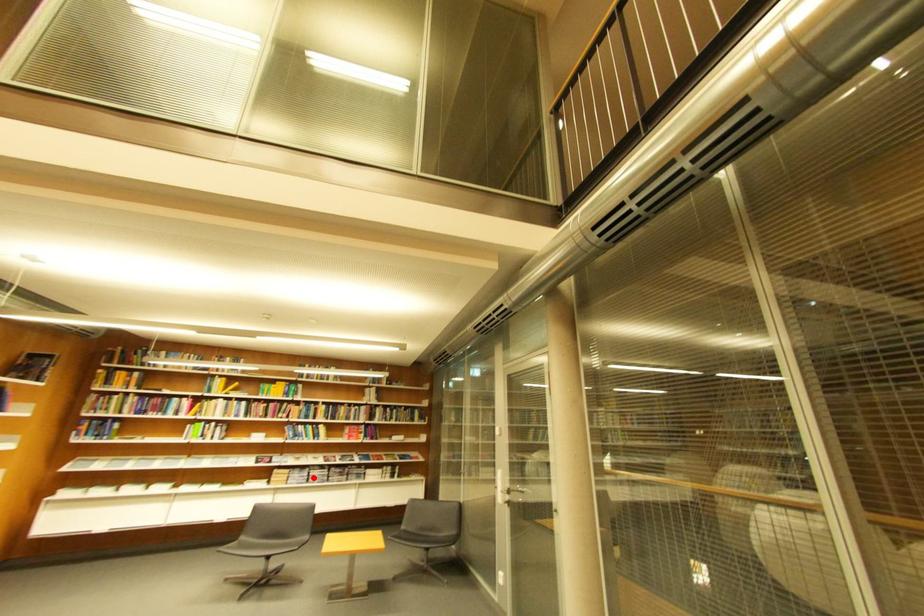
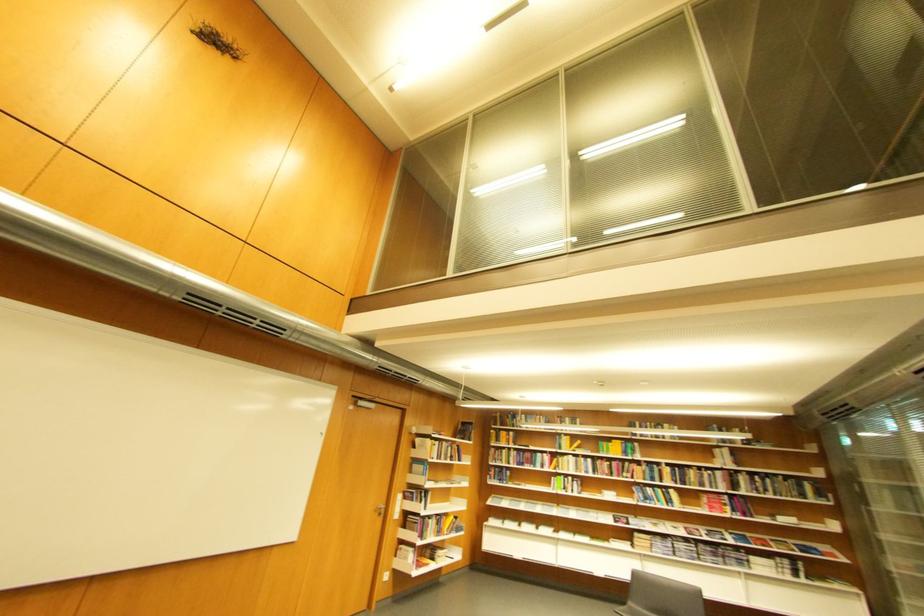
Question: I am providing you with two images of the same scene from different viewpoints. In image1, a red point is highlighted. Considering the same 3D point in image2, which of the following is correct?

Choices:
 (A) It is closer
 (B) It is farther

Answer: (A)